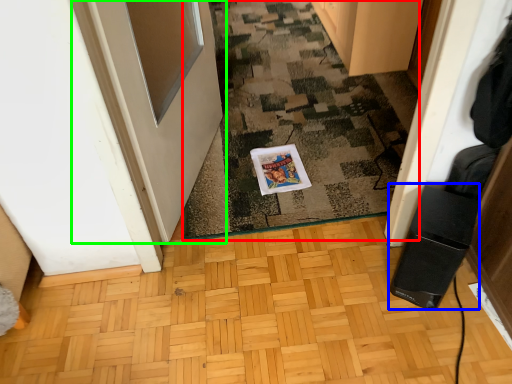
Question: Which object is positioned closest to doormat (highlighted by a red box)? Select from appliance (highlighted by a blue box) and door (highlighted by a green box).

Choices:
 (A) appliance
 (B) door

Answer: (B)